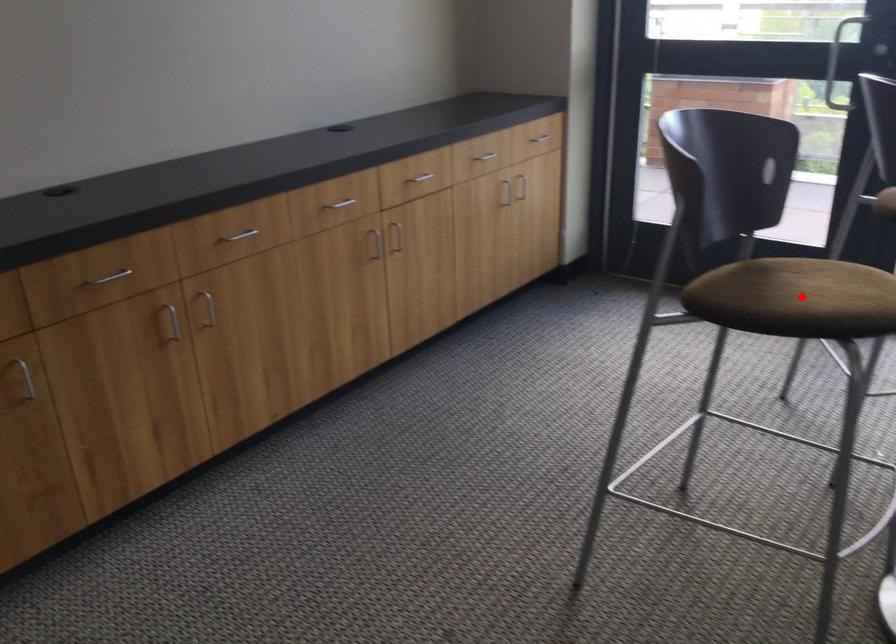
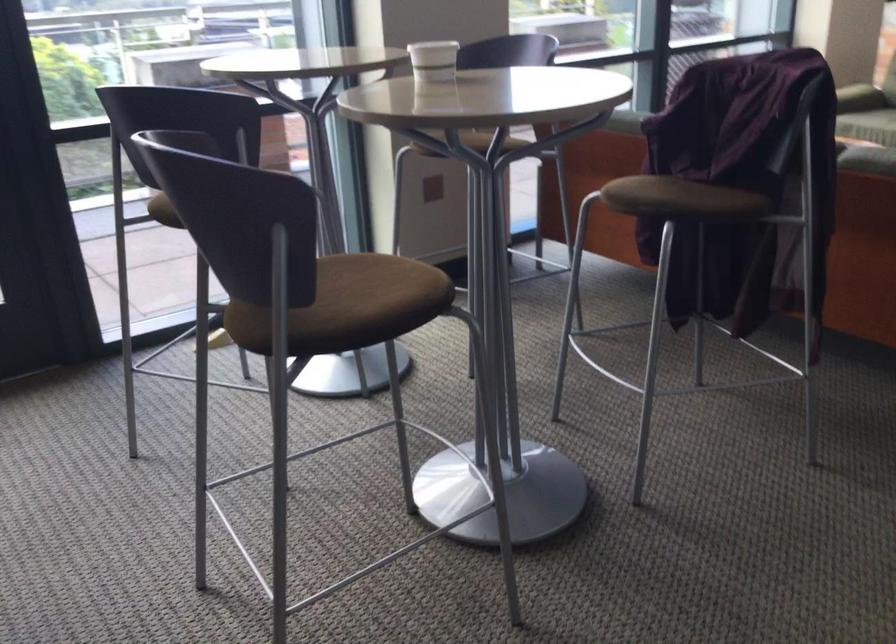
Find the pixel in the second image that matches the highlighted location in the first image.

(371, 292)